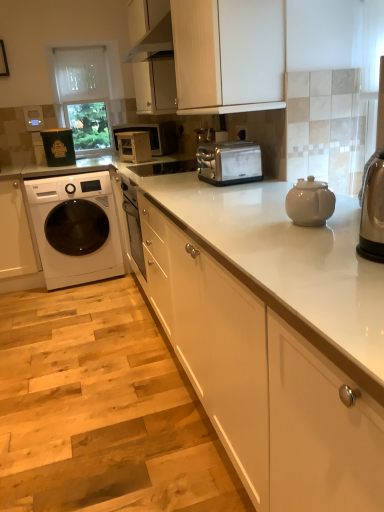
Question: Can you confirm if satin silver microwave at center, the first appliance viewed from the right, is smaller than transparent glass door at upper center, the 2th glass door when ordered from top to bottom?

Choices:
 (A) yes
 (B) no

Answer: (A)

Question: Considering the relative sizes of satin silver microwave at center, the 2th appliance in the left-to-right sequence, and transparent glass door at upper center, acting as the 1th glass door starting from the bottom, in the image provided, is satin silver microwave at center, the 2th appliance in the left-to-right sequence, taller than transparent glass door at upper center, acting as the 1th glass door starting from the bottom,?

Choices:
 (A) no
 (B) yes

Answer: (A)

Question: Is satin silver microwave at center, the first appliance viewed from the right, completely or partially outside of transparent glass door at upper center, acting as the 1th glass door starting from the bottom?

Choices:
 (A) yes
 (B) no

Answer: (A)

Question: Can you see satin silver microwave at center, the first appliance viewed from the right, touching transparent glass door at upper center, the 2th glass door when ordered from top to bottom?

Choices:
 (A) yes
 (B) no

Answer: (B)

Question: Does satin silver microwave at center, the first appliance viewed from the right, lie behind transparent glass door at upper center, acting as the 1th glass door starting from the bottom?

Choices:
 (A) no
 (B) yes

Answer: (A)

Question: Is satin silver toaster at center wider or thinner than satin silver microwave at center, the first appliance viewed from the right?

Choices:
 (A) wide
 (B) thin

Answer: (A)

Question: In terms of size, does satin silver toaster at center appear bigger or smaller than satin silver microwave at center, the 2th appliance in the left-to-right sequence?

Choices:
 (A) small
 (B) big

Answer: (B)

Question: Relative to satin silver microwave at center, the first appliance viewed from the right, is satin silver toaster at center in front or behind?

Choices:
 (A) front
 (B) behind

Answer: (A)

Question: From a real-world perspective, is satin silver toaster at center above or below satin silver microwave at center, the first appliance viewed from the right?

Choices:
 (A) above
 (B) below

Answer: (B)

Question: From a real-world perspective, relative to transparent glass door at upper center, which appears as the 2th glass door when ordered from the bottom, is matte white microwave at center vertically above or below?

Choices:
 (A) above
 (B) below

Answer: (B)

Question: Is matte white microwave at center inside the boundaries of transparent glass door at upper center, which is the 1th glass door in top-to-bottom order, or outside?

Choices:
 (A) outside
 (B) inside

Answer: (A)

Question: Considering the positions of point (153, 133) and point (102, 80), is point (153, 133) closer or farther from the camera than point (102, 80)?

Choices:
 (A) farther
 (B) closer

Answer: (B)

Question: From the image's perspective, is matte white microwave at center positioned above or below transparent glass door at upper center, which appears as the 2th glass door when ordered from the bottom?

Choices:
 (A) above
 (B) below

Answer: (B)

Question: Is point (142, 128) closer or farther from the camera than point (1, 259)?

Choices:
 (A) closer
 (B) farther

Answer: (A)

Question: In the image, is matte white microwave at center on the left side or the right side of white glossy cabinet at left, positioned as the third cabinetry in right-to-left order?

Choices:
 (A) right
 (B) left

Answer: (A)